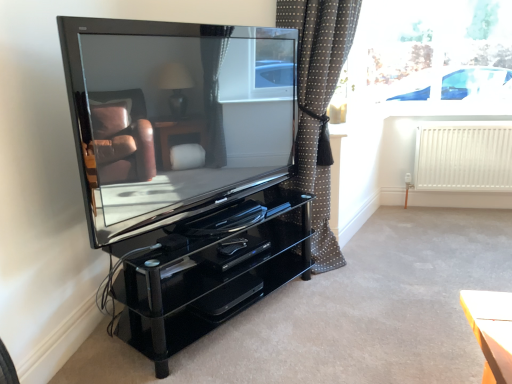
Locate an element on the screen. white matte radiator at right is located at coordinates (463, 158).

In order to face polka dot fabric curtain at center, should I rotate leftwards or rightwards?

To align with it, rotate right about 10.142°.

I want to click on black glossy dvd player at center, so click(234, 252).

Is polka dot fabric curtain at center with white matte radiator at right?

polka dot fabric curtain at center and white matte radiator at right are clearly separated.

Which object is thinner, polka dot fabric curtain at center or white matte radiator at right?

white matte radiator at right is thinner.

There is a white matte radiator at right. Identify the location of curtain above it (from a real-world perspective). (318, 104).

Between polka dot fabric curtain at center and white matte radiator at right, which one is positioned behind?

Positioned behind is white matte radiator at right.

Considering the relative sizes of glossy black television at center and black glossy dvd player at center in the image provided, is glossy black television at center bigger than black glossy dvd player at center?

Yes, glossy black television at center is bigger than black glossy dvd player at center.

How many degrees apart are the facing directions of glossy black television at center and black glossy dvd player at center?

The angle between the facing direction of glossy black television at center and the facing direction of black glossy dvd player at center is 1.74 degrees.

Does glossy black television at center have a lesser width compared to black glossy dvd player at center?

Yes.

Is glossy black television at center not near black glossy dvd player at center?

glossy black television at center is near black glossy dvd player at center, not far away.

Can you tell me how much polka dot fabric curtain at center and black glossy dvd player at center differ in facing direction?

The angular difference between polka dot fabric curtain at center and black glossy dvd player at center is 18.1 degrees.

Considering the relative sizes of polka dot fabric curtain at center and black glossy dvd player at center in the image provided, is polka dot fabric curtain at center bigger than black glossy dvd player at center?

Correct, polka dot fabric curtain at center is larger in size than black glossy dvd player at center.

Does polka dot fabric curtain at center touch black glossy dvd player at center?

No, polka dot fabric curtain at center is not making contact with black glossy dvd player at center.

Looking at this image, from a real-world perspective, is polka dot fabric curtain at center under black glossy dvd player at center?

No.

Considering the relative sizes of white matte radiator at right and glossy black television at center in the image provided, is white matte radiator at right taller than glossy black television at center?

No, white matte radiator at right is not taller than glossy black television at center.

Is white matte radiator at right far from glossy black television at center?

Indeed, white matte radiator at right is not near glossy black television at center.

From the image's perspective, which is above, white matte radiator at right or glossy black television at center?

glossy black television at center.

Considering the positions of points (429, 136) and (64, 61), is point (429, 136) closer to camera compared to point (64, 61)?

No, (429, 136) is further to viewer.

Which is in front, point (393, 83) or point (69, 52)?

The point (69, 52) is in front.

Consider the image. From a real-world perspective, is transparent glass window at upper right physically below glossy black television at center?

Actually, transparent glass window at upper right is physically above glossy black television at center in the real world.

Can glossy black television at center be found inside transparent glass window at upper right?

No, transparent glass window at upper right does not contain glossy black television at center.

Which is in front, transparent glass window at upper right or glossy black television at center?

glossy black television at center is in front.

Who is bigger, black glossy dvd player at center or polka dot fabric curtain at center?

With larger size is polka dot fabric curtain at center.

The image size is (512, 384). What are the coordinates of `curtain behind the black glossy dvd player at center` in the screenshot? It's located at 318,104.

Is black glossy dvd player at center to the left of polka dot fabric curtain at center from the viewer's perspective?

Indeed, black glossy dvd player at center is positioned on the left side of polka dot fabric curtain at center.

Between point (245, 243) and point (322, 245), which one is positioned behind?

The point (322, 245) is behind.

Is white matte radiator at right at the right side of polka dot fabric curtain at center?

Indeed, white matte radiator at right is positioned on the right side of polka dot fabric curtain at center.

Considering the positions of points (429, 178) and (342, 14), is point (429, 178) farther from camera compared to point (342, 14)?

Yes, point (429, 178) is behind point (342, 14).

From the image's perspective, is white matte radiator at right on polka dot fabric curtain at center?

No.

Identify the location of curtain on the left of white matte radiator at right. Image resolution: width=512 pixels, height=384 pixels. (318, 104).

You are a GUI agent. You are given a task and a screenshot of the screen. Output one action in this format:
    pyautogui.click(x=<x>, y=<y>)
    Task: Click on the television above the black glossy dvd player at center (from a real-world perspective)
    
    Given the screenshot: What is the action you would take?
    pyautogui.click(x=175, y=117)

When comparing their distances from black glossy dvd player at center, does white matte radiator at right or transparent glass window at upper right seem closer?

white matte radiator at right lies closer to black glossy dvd player at center than the other object.

Based on the photo, based on their spatial positions, is white matte radiator at right or transparent glass window at upper right closer to polka dot fabric curtain at center?

white matte radiator at right is positioned closer to the anchor polka dot fabric curtain at center.

Based on their spatial positions, is polka dot fabric curtain at center or glossy black television at center closer to black glossy dvd player at center?

glossy black television at center.

Consider the image. Looking at the image, which one is located closer to glossy black television at center, black glossy dvd player at center or white matte radiator at right?

black glossy dvd player at center is closer to glossy black television at center.

Estimate the real-world distances between objects in this image. Which object is further from polka dot fabric curtain at center, white matte radiator at right or glossy black television at center?

Based on the image, white matte radiator at right appears to be further to polka dot fabric curtain at center.

From the image, which object appears to be farther from transparent glass window at upper right, black glossy dvd player at center or white matte radiator at right?

black glossy dvd player at center is further to transparent glass window at upper right.

When comparing their distances from black glossy dvd player at center, does transparent glass window at upper right or white matte radiator at right seem further?

transparent glass window at upper right is further to black glossy dvd player at center.

Consider the image. From the image, which object appears to be nearer to transparent glass window at upper right, glossy black television at center or polka dot fabric curtain at center?

polka dot fabric curtain at center is closer to transparent glass window at upper right.

This screenshot has width=512, height=384. In order to click on radiator between glossy black television at center and transparent glass window at upper right along the z-axis in this screenshot , I will do coord(463,158).

Where is `drawer between glossy black television at center and transparent glass window at upper right from front to back`? The width and height of the screenshot is (512, 384). drawer between glossy black television at center and transparent glass window at upper right from front to back is located at coordinates (234, 252).

Where is `curtain positioned between glossy black television at center and white matte radiator at right from near to far`? Image resolution: width=512 pixels, height=384 pixels. curtain positioned between glossy black television at center and white matte radiator at right from near to far is located at coordinates (318, 104).

Locate an element on the screen. The height and width of the screenshot is (384, 512). radiator between polka dot fabric curtain at center and transparent glass window at upper right along the z-axis is located at coordinates (463, 158).